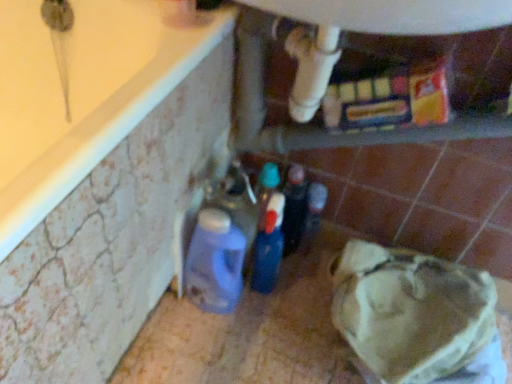
Question: Does white plastic water heater at upper center have a lesser height compared to translucent plastic bottle at center, the 1th bottle viewed from the right?

Choices:
 (A) yes
 (B) no

Answer: (B)

Question: Is white plastic water heater at upper center in contact with translucent plastic bottle at center, positioned as the second bottle in left-to-right order?

Choices:
 (A) no
 (B) yes

Answer: (A)

Question: From a real-world perspective, is white plastic water heater at upper center below translucent plastic bottle at center, positioned as the second bottle in left-to-right order?

Choices:
 (A) yes
 (B) no

Answer: (B)

Question: From the image's perspective, is white plastic water heater at upper center under translucent plastic bottle at center, the 1th bottle viewed from the right?

Choices:
 (A) yes
 (B) no

Answer: (B)

Question: Is white plastic water heater at upper center turned away from translucent plastic bottle at center, positioned as the second bottle in left-to-right order?

Choices:
 (A) no
 (B) yes

Answer: (A)

Question: From a real-world perspective, relative to translucent plastic bottle at center, positioned as the second bottle in left-to-right order, is white plastic water heater at upper center vertically above or below?

Choices:
 (A) above
 (B) below

Answer: (A)

Question: Is white plastic water heater at upper center in front of or behind translucent plastic bottle at center, positioned as the second bottle in left-to-right order, in the image?

Choices:
 (A) behind
 (B) front

Answer: (B)

Question: Is point (359, 29) positioned closer to the camera than point (308, 223)?

Choices:
 (A) farther
 (B) closer

Answer: (B)

Question: From the image's perspective, is white plastic water heater at upper center located above or below translucent plastic bottle at center, the 1th bottle viewed from the right?

Choices:
 (A) below
 (B) above

Answer: (B)

Question: From the image's perspective, relative to matte plastic detergent at lower left, positioned as the 1th bottle in left-to-right order, is translucent plastic bottle at center, positioned as the second bottle in left-to-right order, above or below?

Choices:
 (A) below
 (B) above

Answer: (B)

Question: From a real-world perspective, relative to matte plastic detergent at lower left, arranged as the 2th bottle when viewed from the right, is translucent plastic bottle at center, the 1th bottle viewed from the right, vertically above or below?

Choices:
 (A) below
 (B) above

Answer: (A)

Question: Considering their positions, is translucent plastic bottle at center, the 1th bottle viewed from the right, located in front of or behind matte plastic detergent at lower left, arranged as the 2th bottle when viewed from the right?

Choices:
 (A) front
 (B) behind

Answer: (B)

Question: In terms of width, does translucent plastic bottle at center, the 1th bottle viewed from the right, look wider or thinner when compared to matte plastic detergent at lower left, arranged as the 2th bottle when viewed from the right?

Choices:
 (A) wide
 (B) thin

Answer: (B)

Question: Is matte plastic detergent at lower left, positioned as the 1th bottle in left-to-right order, taller or shorter than translucent plastic bottle at center, positioned as the second bottle in left-to-right order?

Choices:
 (A) tall
 (B) short

Answer: (A)

Question: In terms of size, does matte plastic detergent at lower left, positioned as the 1th bottle in left-to-right order, appear bigger or smaller than translucent plastic bottle at center, the 1th bottle viewed from the right?

Choices:
 (A) small
 (B) big

Answer: (B)